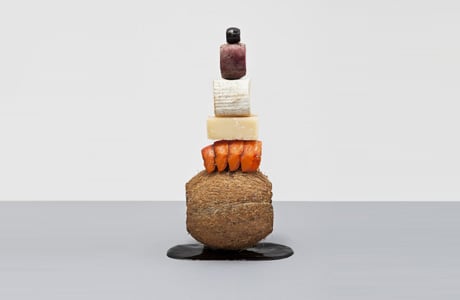
The image size is (460, 300). I want to click on gray floor, so click(352, 274).